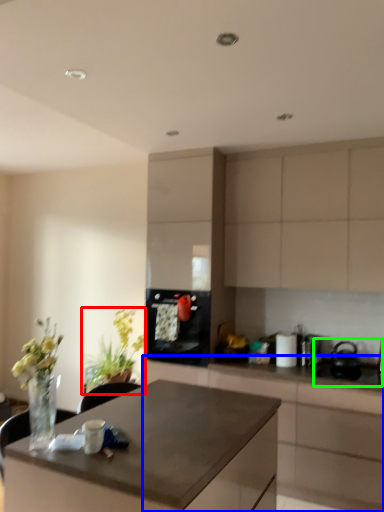
Question: Which is nearer to the houseplant (highlighted by a red box)? cabinetry (highlighted by a blue box) or sink (highlighted by a green box).

Choices:
 (A) cabinetry
 (B) sink

Answer: (A)